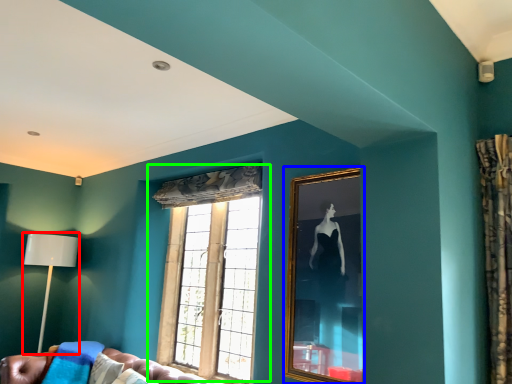
Question: Based on their relative distances, which object is farther from table lamp (highlighted by a red box)? Choose from picture frame (highlighted by a blue box) and window (highlighted by a green box).

Choices:
 (A) picture frame
 (B) window

Answer: (A)